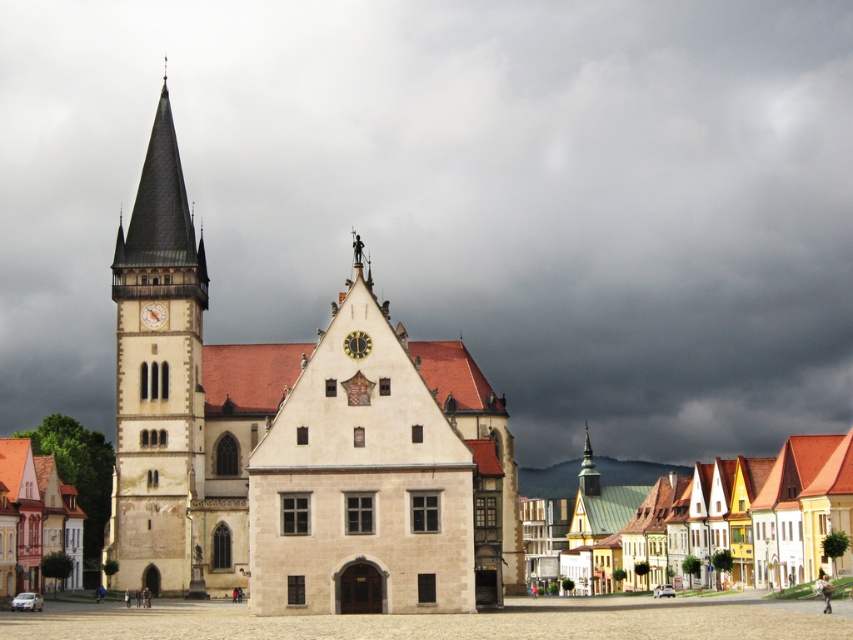
You are an architect planning to install a new flagpole on the roof of the white painted wooden houses at lower right. The flagpole needs to be 10 meters tall. Given the height of the dark gray cloud at upper center compared to the houses, do you think the flagpole will be visible above the houses when viewed from the town square?

The dark gray cloud at upper center is much taller than the white painted wooden houses at lower right, so the flagpole will be visible above the white painted wooden houses at lower right since the cloud is higher and provides a clear vertical space for the flagpole to extend upwards.

You are an architect visiting the town square and notice the dark gray cloud at upper center and the white painted wooden houses at lower right. Which object is closer to your viewpoint?

The dark gray cloud at upper center is closer to the viewer than the white painted wooden houses at lower right.

You are a drone operator tasked with capturing aerial footage of the historic building and its clock tower. Your drone has a maximum flight range of 150 feet. If you position the drone at the dark gray cloud at upper center, can it safely fly to the gold textured spire at center without exceeding its range?

The distance between the dark gray cloud at upper center and the gold textured spire at center is 141.15 feet, which is within the drone operator drone operator drone operator drone operator drone operator drone operator drone operator drone operator drone operator drone operator drone operator drone operator drone operator drone operator drone operator drone operator drone operator drone operator drone operator drone operator drone operator drone operator drone operator drone operator drone operator drone